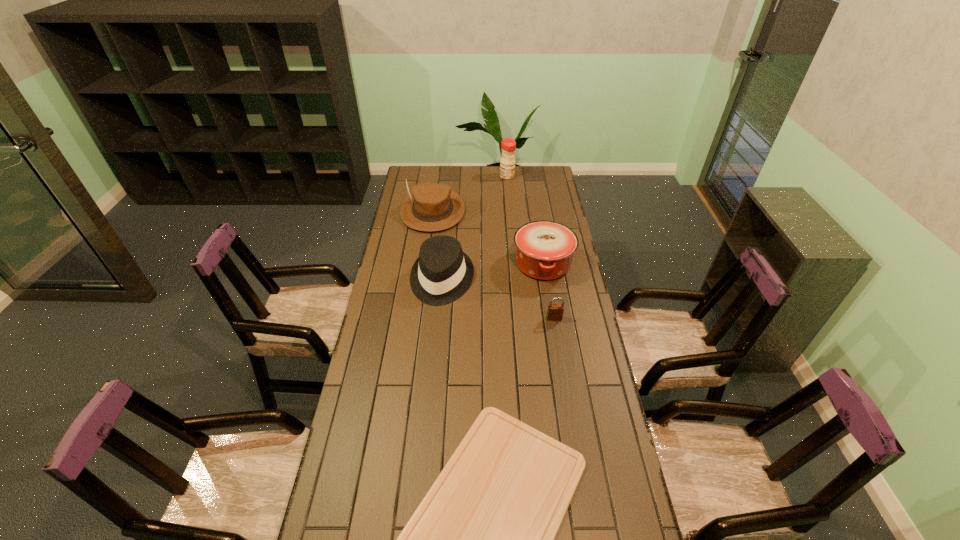
Where is `free space between the nearer fedora and the tallest object`? The width and height of the screenshot is (960, 540). free space between the nearer fedora and the tallest object is located at coordinates (474, 228).

Find the location of `free area in between the fifth nearest object and the padlock`. free area in between the fifth nearest object and the padlock is located at coordinates (493, 265).

Locate an element on the screen. The height and width of the screenshot is (540, 960). free space between the casserole and the nearer fedora is located at coordinates (492, 272).

Identify the location of free area in between the casserole and the padlock. The image size is (960, 540). (549, 291).

At what (x,y) coordinates should I click in order to perform the action: click on free space that is in between the casserole and the nearer fedora. Please return your answer as a coordinate pair (x, y). Looking at the image, I should click on (492, 272).

Where is `free space that is in between the farthest object and the nearer fedora`? free space that is in between the farthest object and the nearer fedora is located at coordinates (474, 228).

Locate an element on the screen. This screenshot has height=540, width=960. vacant region between the second nearest object and the farther fedora is located at coordinates pyautogui.click(x=493, y=265).

Identify the location of object that is the third closest one to the fifth tallest object. (482, 539).

You are a GUI agent. You are given a task and a screenshot of the screen. Output one action in this format:
    pyautogui.click(x=<x>, y=<y>)
    Task: Click on the third closest object to the nearer fedora
    
    Given the screenshot: What is the action you would take?
    pyautogui.click(x=555, y=311)

The height and width of the screenshot is (540, 960). Find the location of `vacant space that satisfies the following two spatial constraints: 1. on the feather side of the fifth nearest object; 2. on the right side of the nearer fedora`. vacant space that satisfies the following two spatial constraints: 1. on the feather side of the fifth nearest object; 2. on the right side of the nearer fedora is located at coordinates (423, 280).